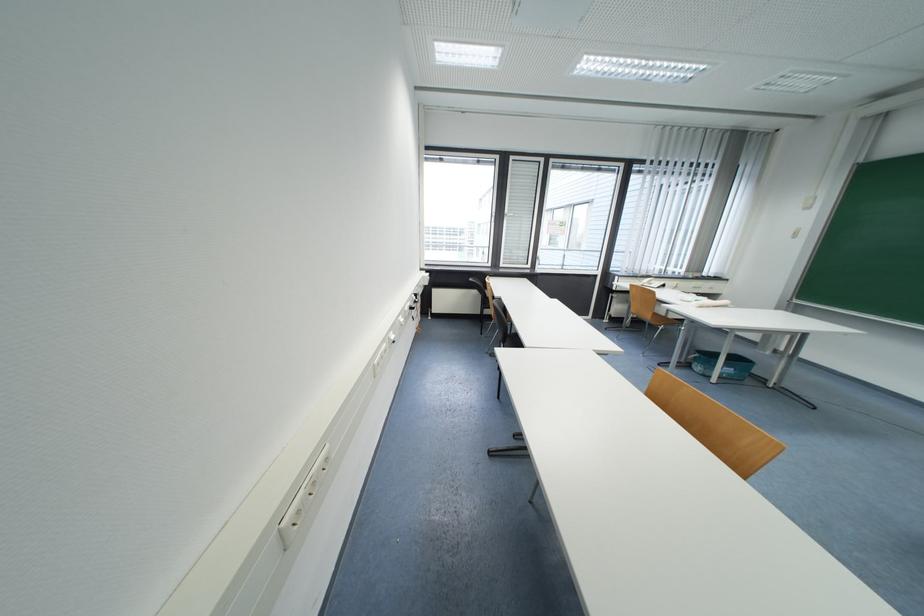
The image size is (924, 616). Describe the element at coordinates (509, 339) in the screenshot. I see `the black chair sitting surface` at that location.